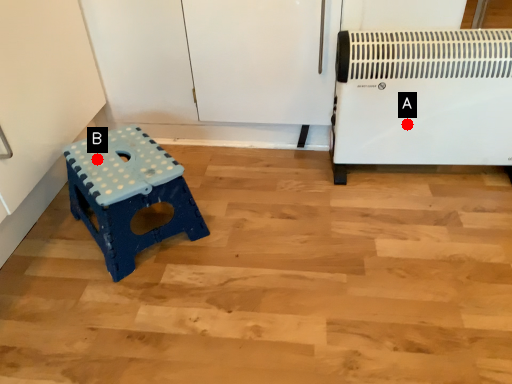
Question: Two points are circled on the image, labeled by A and B beside each circle. Which of the following is the closest to the observer?

Choices:
 (A) A is closer
 (B) B is closer

Answer: (B)